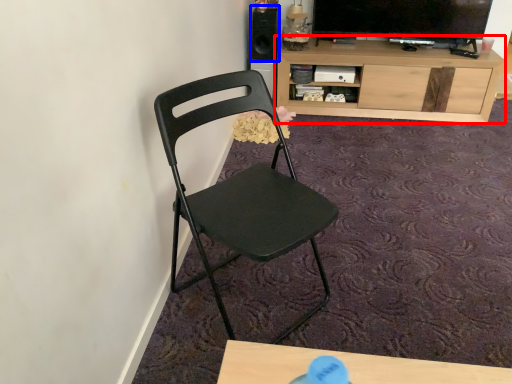
Question: Which of the following is the farthest to the observer, cabinetry (highlighted by a red box) or speaker (highlighted by a blue box)?

Choices:
 (A) cabinetry
 (B) speaker

Answer: (B)